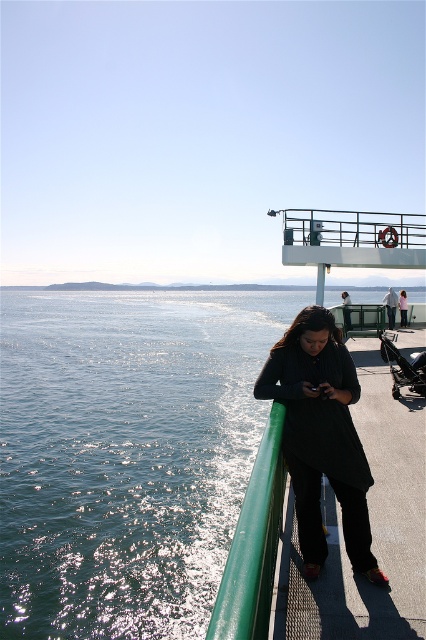
You are a photographer trying to capture the reflection of the black matte dress at center on the water. Based on the scene description, where should you position yourself relative to the dress to ensure the reflection is visible?

The black matte dress at center is located at point (321, 436), so you should position yourself directly in front of the dress at center to capture its reflection on the water.

Looking at this image, you are standing on the ferry and want to take a photo of the shiny blue water at left and the green rubber rail at lower center. Which object will appear larger in the photo?

The shiny blue water at left will appear larger in the photo because it is taller than the green rubber rail at lower center.